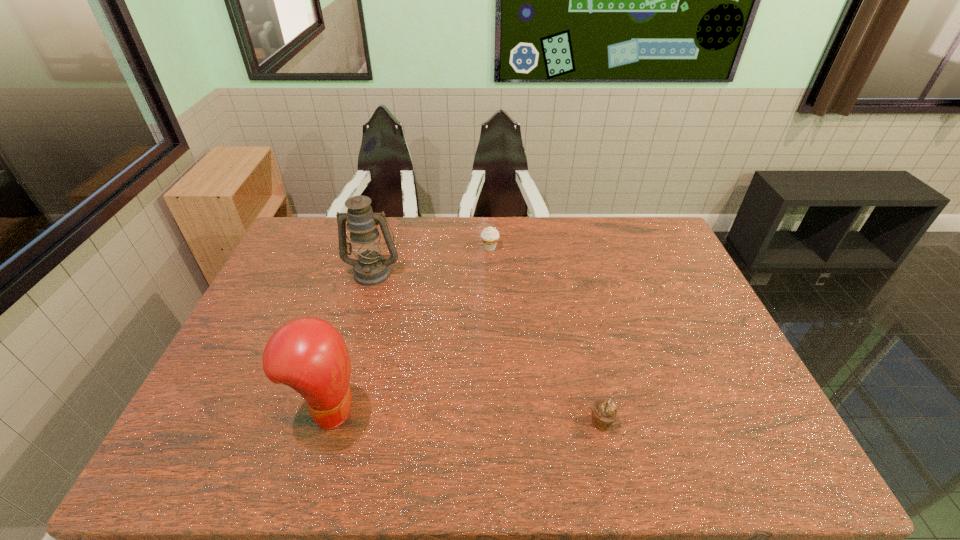
At what (x,y) coordinates should I click in order to perform the action: click on free spot between the boxing glove and the third object from left to right. Please return your answer as a coordinate pair (x, y). Image resolution: width=960 pixels, height=540 pixels. Looking at the image, I should click on (409, 328).

This screenshot has height=540, width=960. Find the location of `free spot between the rightmost object and the second farthest object`. free spot between the rightmost object and the second farthest object is located at coordinates (487, 347).

Where is `empty location between the oil lamp and the boxing glove`? Image resolution: width=960 pixels, height=540 pixels. empty location between the oil lamp and the boxing glove is located at coordinates (350, 341).

I want to click on free area in between the boxing glove and the second farthest object, so click(x=350, y=341).

Where is `free spot between the second object from right to left and the nearer muffin`? free spot between the second object from right to left and the nearer muffin is located at coordinates (545, 335).

Image resolution: width=960 pixels, height=540 pixels. I want to click on unoccupied position between the boxing glove and the oil lamp, so [350, 341].

What are the coordinates of `object that is the third closest to the boxing glove` in the screenshot? It's located at (490, 236).

Locate which object is the second closest to the rightmost object. Please provide its 2D coordinates. Your answer should be formatted as a tuple, i.e. [(x, y)], where the tuple contains the x and y coordinates of a point satisfying the conditions above.

[(490, 236)]

Identify the location of free spot that satisfies the following two spatial constraints: 1. on the back side of the right muffin; 2. on the striking surface of the boxing glove. The width and height of the screenshot is (960, 540). (599, 409).

Locate an element on the screen. vacant region that satisfies the following two spatial constraints: 1. on the striking surface of the boxing glove; 2. on the back side of the nearer muffin is located at coordinates (325, 422).